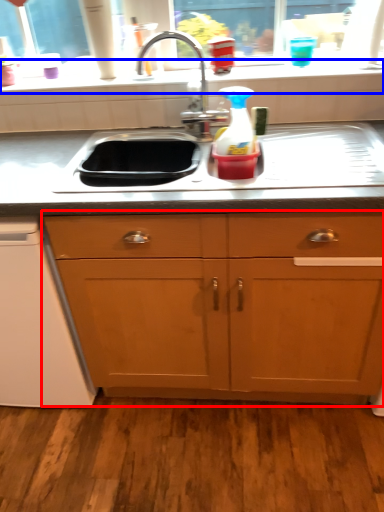
Question: Which of the following is the closest to the observer, cabinetry (highlighted by a red box) or window sill (highlighted by a blue box)?

Choices:
 (A) cabinetry
 (B) window sill

Answer: (A)